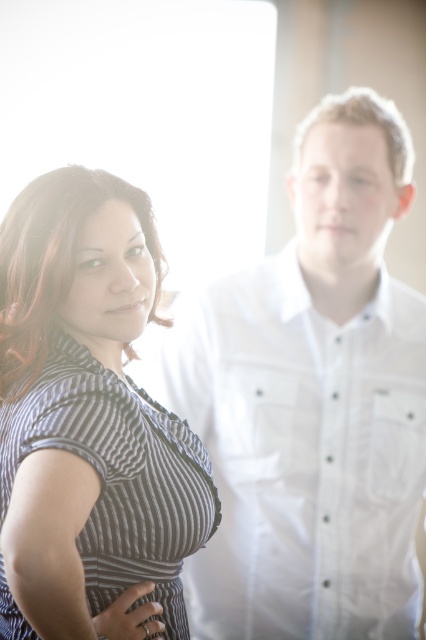
You are a photographer setting up a portrait shoot. You have two outfits to choose from for the subject on the left side of the image. The options are the white cotton shirt at left and the striped fabric dress at left. Based on their widths, which outfit would you recommend if you want the subject to appear more voluminous in the photo?

The white cotton shirt at left might be wider than striped fabric dress at left, so choosing the white cotton shirt at left would make the subject appear more voluminous in the photo.

Looking at this image, based on the scene description, where is the white cotton shirt at left located in terms of its 2D coordinates?

The white cotton shirt at left is located at the 2D coordinates of point [302,456].

You are organizing a charity clothing drive and need to determine which items can fit into a donation box that has a maximum capacity of 1000 cubic centimeters. You have two items to assess from the image provided. Which item between the white cotton shirt at left and the striped fabric dress at left is more likely to fit into the box?

The white cotton shirt at left is smaller than the striped fabric dress at left, so it is more likely to fit into the donation box with a 1000 cubic centimeter capacity.